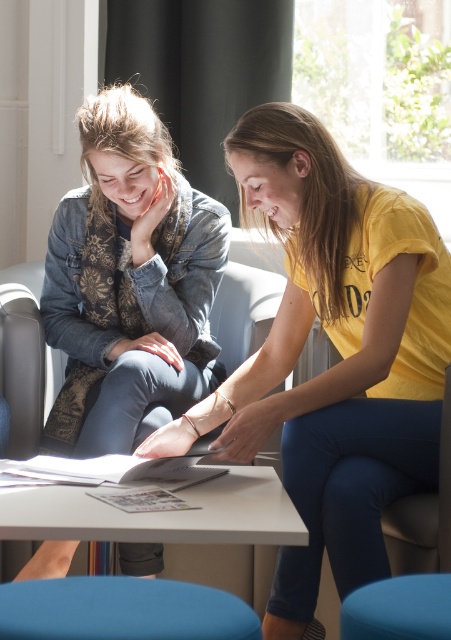
You are trying to decide where to place a new plant pot between the denim jacket at upper left and the white glossy table at center. Which side of the table should you place it on to keep it aligned with the existing arrangement?

The denim jacket at upper left is positioned on the left side of white glossy table at center, so placing the plant pot on the left side of the table would align it with the existing arrangement.

You are designing a storage system for a small office. You have a storage shelf that can only accommodate items narrower than the blue fabric stool at lower center. Can the denim jacket at upper left fit on the shelf?

The denim jacket at upper left is wider than the blue fabric stool at lower center, so it cannot fit on the shelf designed for items narrower than the blue fabric stool at lower center.